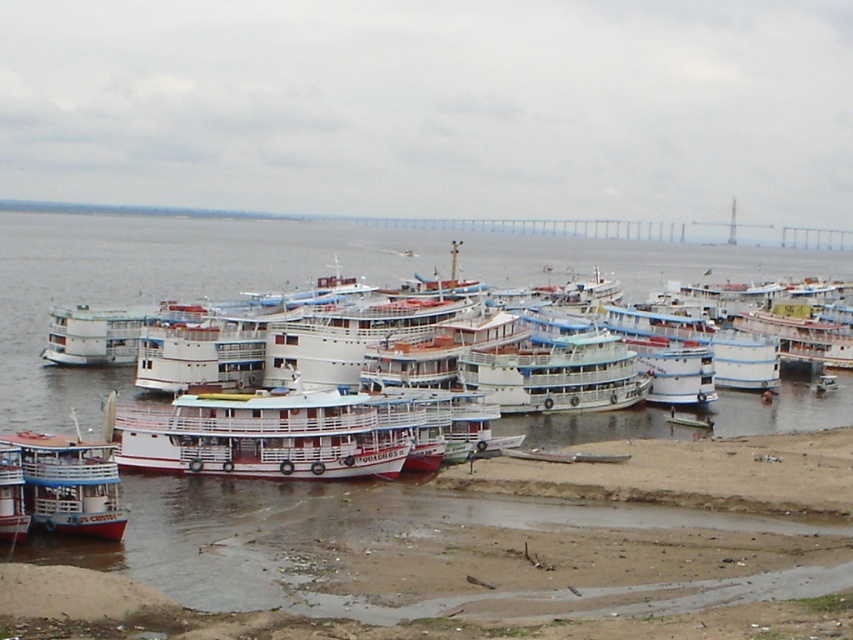
Does white matte boat at center have a greater height compared to white glossy boat at lower left?

Indeed, white matte boat at center has a greater height compared to white glossy boat at lower left.

Between point (364, 403) and point (119, 524), which one is positioned behind?

Positioned behind is point (364, 403).

Describe the element at coordinates (260, 436) in the screenshot. I see `white matte boat at center` at that location.

This screenshot has width=853, height=640. What are the coordinates of `white matte boat at center` in the screenshot? It's located at (260, 436).